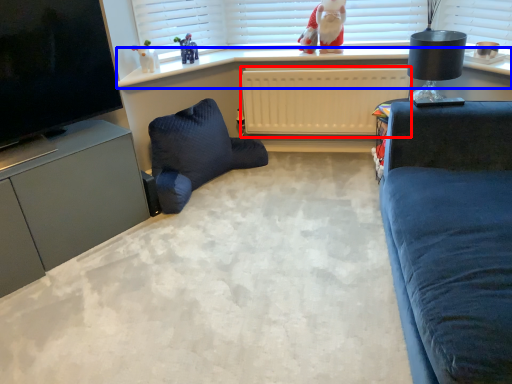
Question: Which point is closer to the camera, radiator (highlighted by a red box) or window sill (highlighted by a blue box)?

Choices:
 (A) radiator
 (B) window sill

Answer: (B)